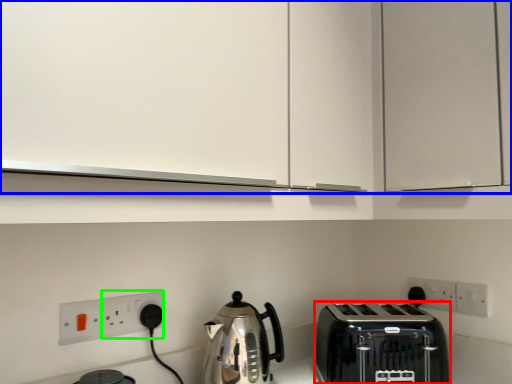
Question: Estimate the real-world distances between objects in this image. Which object is farther from toaster (highlighted by a red box), cabinetry (highlighted by a blue box) or electric outlet (highlighted by a green box)?

Choices:
 (A) cabinetry
 (B) electric outlet

Answer: (B)